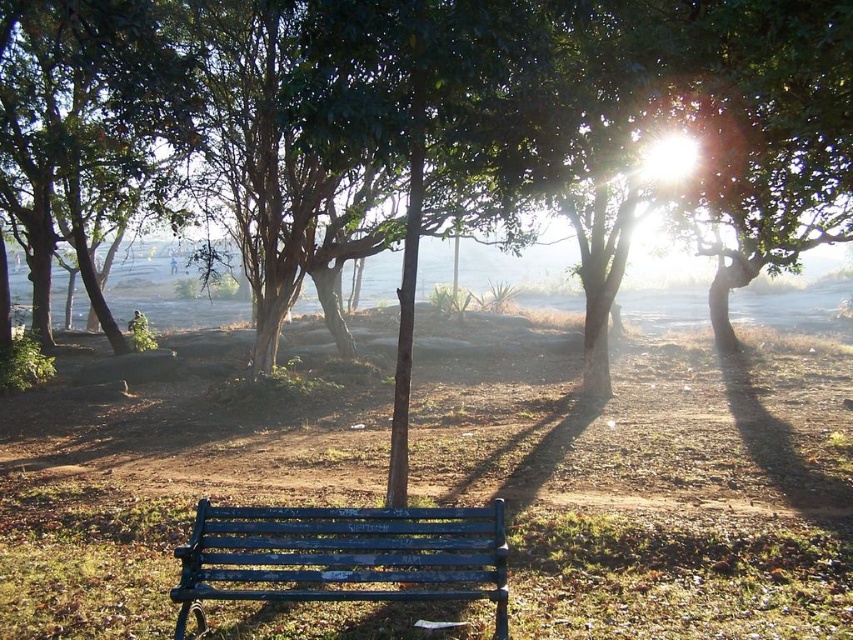
Can you confirm if green leafy tree at center is positioned above blue painted wood bench at center?

Yes, green leafy tree at center is above blue painted wood bench at center.

What do you see at coordinates (605, 97) in the screenshot? The width and height of the screenshot is (853, 640). I see `green leafy tree at center` at bounding box center [605, 97].

Is point (28, 1) farther from viewer compared to point (422, 528)?

That is True.

This screenshot has height=640, width=853. I want to click on green leafy tree at center, so click(x=605, y=97).

Image resolution: width=853 pixels, height=640 pixels. Describe the element at coordinates (653, 486) in the screenshot. I see `green grass at center` at that location.

Between green grass at center and blue painted wood bench at center, which one appears on the right side from the viewer's perspective?

Positioned to the right is green grass at center.

Is point (299, 611) in front of point (351, 508)?

Yes, point (299, 611) is closer to viewer.

Identify the location of green grass at center. The image size is (853, 640). (653, 486).

Can you confirm if green grass at center is positioned to the left of green leafy tree at center?

Indeed, green grass at center is positioned on the left side of green leafy tree at center.

Can you confirm if green grass at center is positioned above green leafy tree at center?

No.

Which is behind, point (575, 570) or point (604, 392)?

Positioned behind is point (604, 392).

Locate an element on the screen. The width and height of the screenshot is (853, 640). green grass at center is located at coordinates (653, 486).